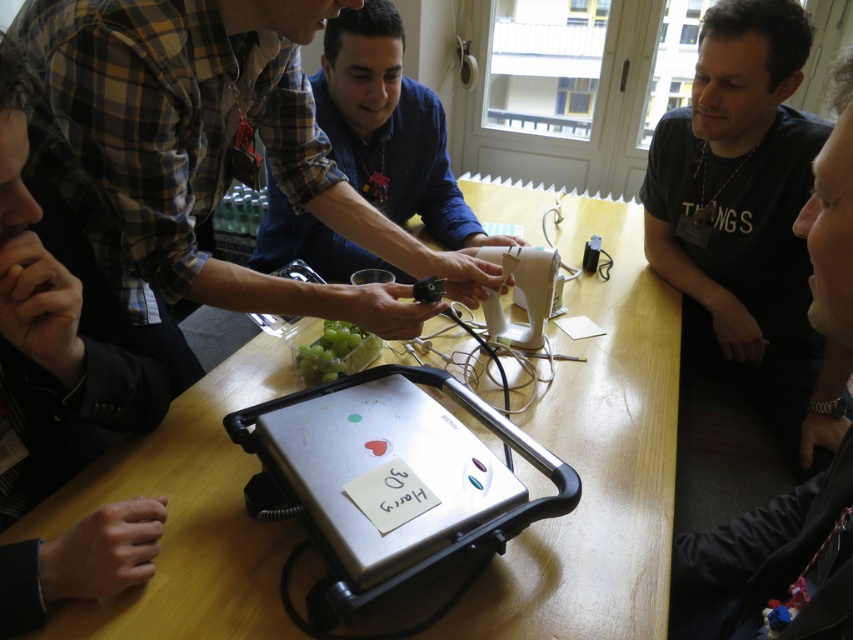
You are a delivery person who just arrived at the office to deliver a package. You notice the plaid shirt at left and the silver metallic sandwich maker at center on the table. Which object would block your view of the other if you were standing directly in front of the table?

The plaid shirt at left is bigger than the silver metallic sandwich maker at center, so it would block your view of the silver metallic sandwich maker at center if you were standing directly in front of the table.

You are a delivery person who needs to place a package on the wooden table at center without touching the black matte shirt at upper right. Is there enough space between them to do so?

The wooden table at center is 14.79 inches away from the black matte shirt at upper right. Since the distance between them is sufficient, you can safely place the package on the wooden table at center without touching the black matte shirt at upper right.

You are a delivery person who needs to place a package between the black matte shirt at upper right and the green matte grapes at center. The package is 90 centimeters long. Can you fit it between them?

The distance between the black matte shirt at upper right and the green matte grapes at center is 89.39 centimeters. Since the package is 90 centimeters long, it is slightly longer than the available space. Therefore, the package cannot be placed between them.